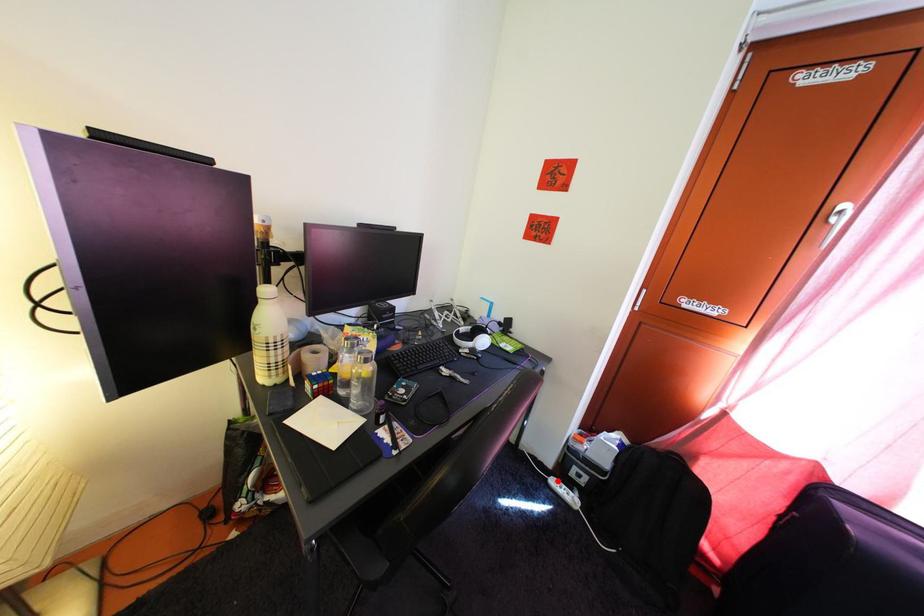
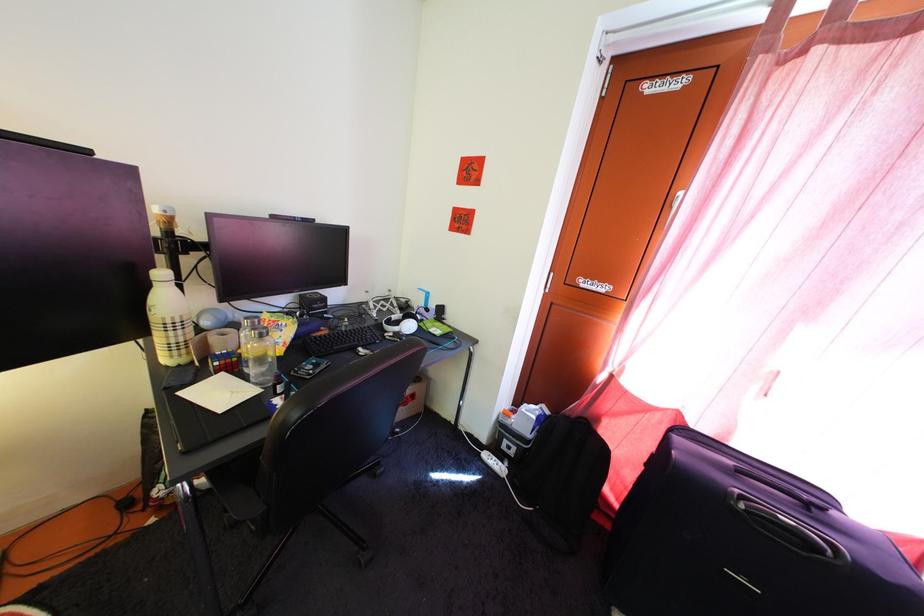
In the second image, find the point that corresponds to the highlighted location in the first image.

(492, 456)